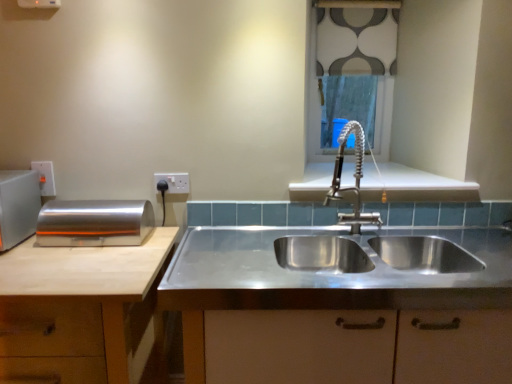
This screenshot has height=384, width=512. Find the location of `vacant space in front of silver metallic breadbox at left, acting as the second appliance starting from the left`. vacant space in front of silver metallic breadbox at left, acting as the second appliance starting from the left is located at coordinates (73, 258).